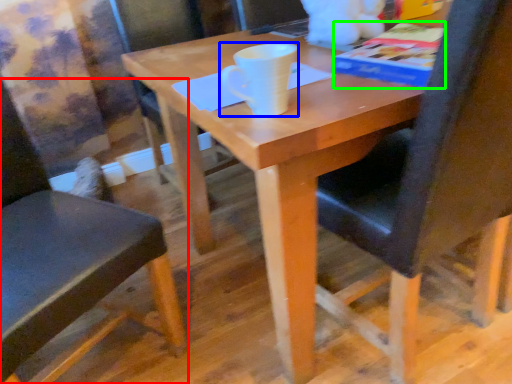
Question: Which object is the closest to the chair (highlighted by a red box)? Choose among these: coffee cup (highlighted by a blue box) or paperback book (highlighted by a green box).

Choices:
 (A) coffee cup
 (B) paperback book

Answer: (A)